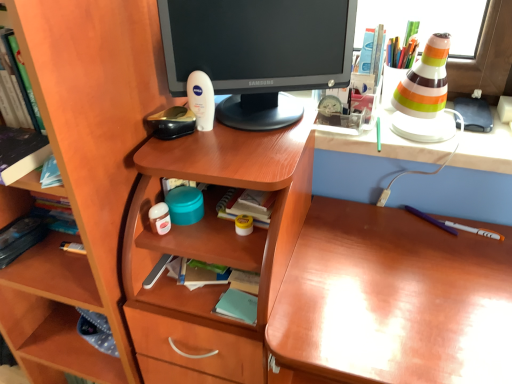
Question: From the image's perspective, does light blue paper at center, the first book positioned from the right, appear lower than matte black monitor at center?

Choices:
 (A) yes
 (B) no

Answer: (A)

Question: From a real-world perspective, is light blue paper at center, the second book in the back-to-front sequence, on top of matte black monitor at center?

Choices:
 (A) yes
 (B) no

Answer: (B)

Question: Is light blue paper at center, the first book positioned from the right, smaller than matte black monitor at center?

Choices:
 (A) no
 (B) yes

Answer: (B)

Question: Considering the relative sizes of light blue paper at center, positioned as the second book in front-to-back order, and matte black monitor at center in the image provided, is light blue paper at center, positioned as the second book in front-to-back order, bigger than matte black monitor at center?

Choices:
 (A) yes
 (B) no

Answer: (B)

Question: Is light blue paper at center, which is the third book in left-to-right order, further to camera compared to matte black monitor at center?

Choices:
 (A) no
 (B) yes

Answer: (B)

Question: Considering the relative sizes of light blue paper at center, the third book positioned from the top, and matte black monitor at center in the image provided, is light blue paper at center, the third book positioned from the top, taller than matte black monitor at center?

Choices:
 (A) yes
 (B) no

Answer: (B)

Question: Can you confirm if hardcover book at left, which is the third book in bottom-to-top order, is bigger than glossy wood desk at center?

Choices:
 (A) no
 (B) yes

Answer: (A)

Question: From the image's perspective, does hardcover book at left, the first book in the top-to-bottom sequence, appear lower than glossy wood desk at center?

Choices:
 (A) yes
 (B) no

Answer: (B)

Question: Is hardcover book at left, arranged as the second book when viewed from the right, not inside glossy wood desk at center?

Choices:
 (A) yes
 (B) no

Answer: (A)

Question: Does hardcover book at left, the first book in the top-to-bottom sequence, have a smaller size compared to glossy wood desk at center?

Choices:
 (A) no
 (B) yes

Answer: (B)

Question: Considering the relative positions of hardcover book at left, which is the third book in bottom-to-top order, and glossy wood desk at center in the image provided, is hardcover book at left, which is the third book in bottom-to-top order, to the left of glossy wood desk at center from the viewer's perspective?

Choices:
 (A) no
 (B) yes

Answer: (B)

Question: Can you confirm if hardcover book at left, the first book in the top-to-bottom sequence, is positioned to the right of glossy wood desk at center?

Choices:
 (A) no
 (B) yes

Answer: (A)

Question: From the image's perspective, is hardcover book at left, acting as the 3th book starting from the front, under light blue paper at center, which is the third book in left-to-right order?

Choices:
 (A) yes
 (B) no

Answer: (B)